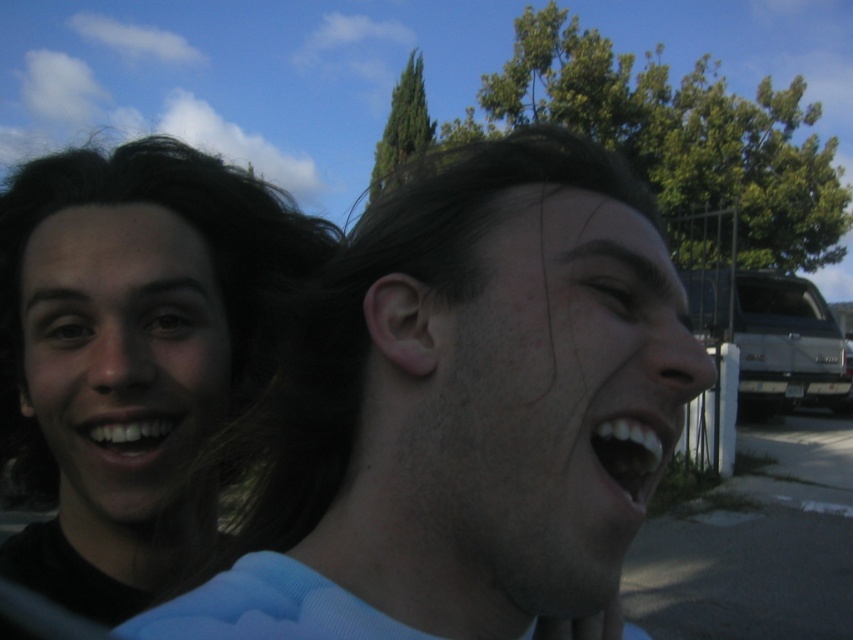
You are a photographer trying to capture a clear photo of both the matte black face at left and the white glossy teeth at center. Since the background has bright sunlight, which object might be more prone to glare and why?

The white glossy teeth at center are more prone to glare because their glossy surface reflects light more intensely than the matte black face at left, which has a non reflective surface.